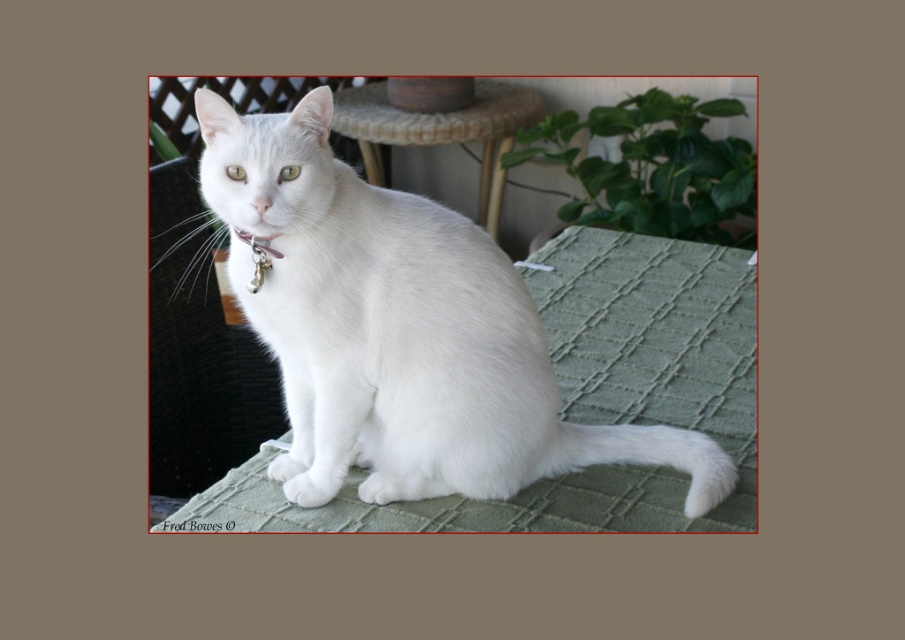
Question: Observing the image, what is the correct spatial positioning of white fur cat at center in reference to green woven table at center?

Choices:
 (A) below
 (B) above

Answer: (A)

Question: Does white fur cat at center come in front of green woven table at center?

Choices:
 (A) no
 (B) yes

Answer: (B)

Question: Does white fur cat at center appear on the left side of green woven table at center?

Choices:
 (A) yes
 (B) no

Answer: (B)